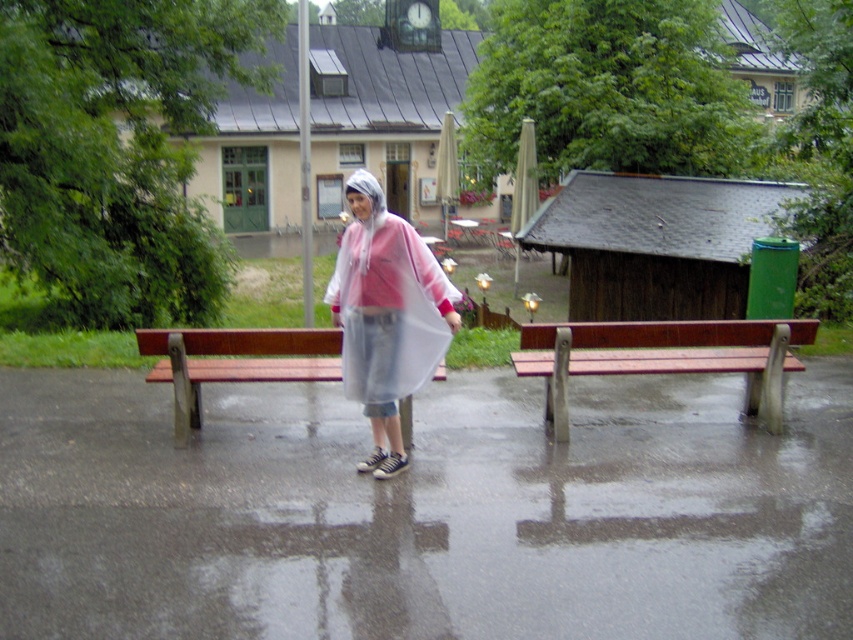
You are a delivery person trying to reach the brown wooden bench at left without getting your package wet. The transparent plastic poncho at center is available. Can you walk directly to the bench without touching the poncho?

The transparent plastic poncho at center and brown wooden bench at left are 1.09 meters apart from each other. Since the distance between them is sufficient, you can walk directly to the brown wooden bench at left without touching the poncho.

From the picture: You are standing at point (386, 316) in the image. What object is located exactly at this point?

The transparent plastic poncho at center is located exactly at point 0.454, 0.454.